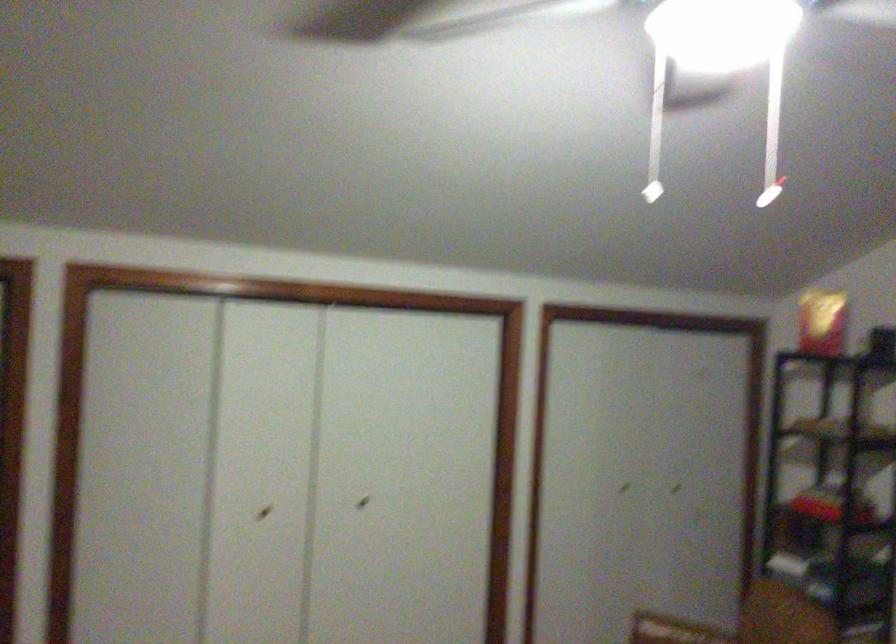
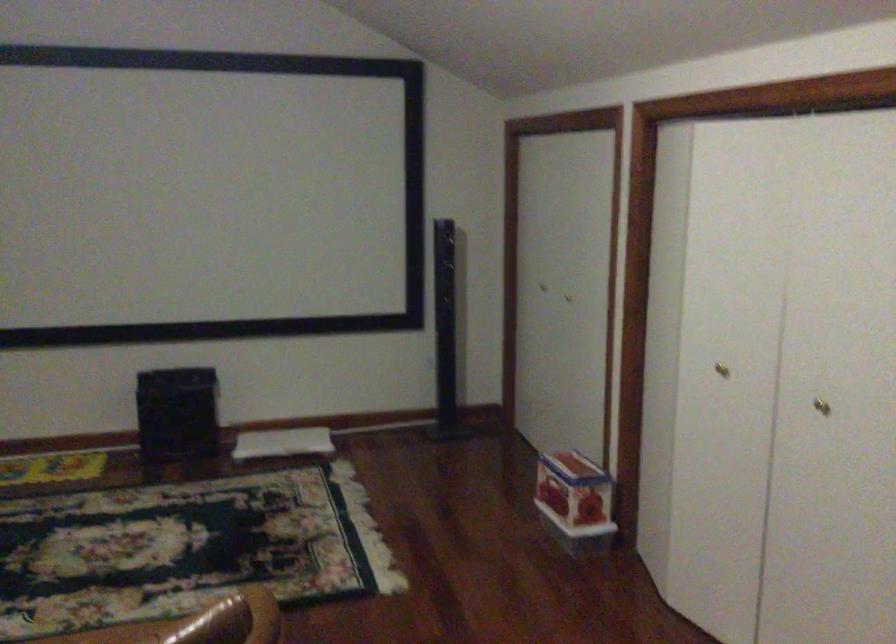
Where in the second image is the point corresponding to [357,500] from the first image?

(821, 406)